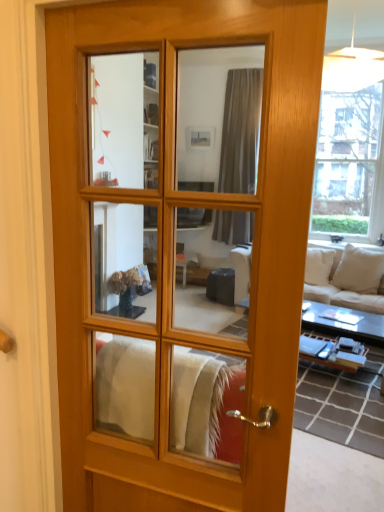
The image size is (384, 512). In order to click on matte wood door at center in this screenshot , I will do `click(173, 248)`.

What do you see at coordinates (173, 248) in the screenshot? The image size is (384, 512). I see `matte wood door at center` at bounding box center [173, 248].

You are a GUI agent. You are given a task and a screenshot of the screen. Output one action in this format:
    pyautogui.click(x=<x>, y=<y>)
    Task: Click on the white fabric couch at right
    This screenshot has height=512, width=384.
    Given the screenshot: What is the action you would take?
    click(346, 277)

This screenshot has width=384, height=512. What do you see at coordinates (346, 277) in the screenshot?
I see `white fabric couch at right` at bounding box center [346, 277].

Find the location of a particular element. matte wood door at center is located at coordinates (173, 248).

Between white fabric couch at right and matte wood door at center, which one appears on the left side from the viewer's perspective?

Positioned to the left is matte wood door at center.

Which object is more forward, white fabric couch at right or matte wood door at center?

matte wood door at center is in front.

Is point (309, 272) closer or farther from the camera than point (208, 205)?

Clearly, point (309, 272) is more distant from the camera than point (208, 205).

From the image's perspective, is white fabric couch at right on matte wood door at center?

No, from the image's perspective, white fabric couch at right is not above matte wood door at center.

From a real-world perspective, is white fabric couch at right below matte wood door at center?

Yes, from a real-world perspective, white fabric couch at right is below matte wood door at center.

Between white fabric couch at right and matte wood door at center, which one has smaller width?

matte wood door at center is thinner.

Is white fabric couch at right taller than matte wood door at center?

No, white fabric couch at right is not taller than matte wood door at center.

Is white fabric couch at right smaller than matte wood door at center?

No.

Is white fabric couch at right surrounding matte wood door at center?

No, white fabric couch at right does not contain matte wood door at center.

Is white fabric couch at right far from matte wood door at center?

Indeed, white fabric couch at right is not near matte wood door at center.

Is white fabric couch at right positioned with its back to matte wood door at center?

No, matte wood door at center is not at the back of white fabric couch at right.

Can you tell me how much white fabric couch at right and matte wood door at center differ in facing direction?

The angular difference between white fabric couch at right and matte wood door at center is 167 degrees.

The height and width of the screenshot is (512, 384). I want to click on studio couch located underneath the matte wood door at center (from a real-world perspective), so click(x=346, y=277).

Does matte wood door at center appear on the left side of white fabric couch at right?

Indeed, matte wood door at center is positioned on the left side of white fabric couch at right.

Is matte wood door at center further to the viewer compared to white fabric couch at right?

No, it is in front of white fabric couch at right.

Which point is more distant from viewer, (100, 499) or (335, 266)?

The point (335, 266) is farther from the camera.

From the image's perspective, which one is positioned higher, matte wood door at center or white fabric couch at right?

From the image's view, matte wood door at center is above.

From a real-world perspective, does matte wood door at center sit lower than white fabric couch at right?

No, from a real-world perspective, matte wood door at center is not below white fabric couch at right.

Is matte wood door at center wider or thinner than white fabric couch at right?

Considering their sizes, matte wood door at center looks slimmer than white fabric couch at right.

In the scene shown: Who is taller, matte wood door at center or white fabric couch at right?

matte wood door at center is taller.

Is matte wood door at center bigger than white fabric couch at right?

Actually, matte wood door at center might be smaller than white fabric couch at right.

Is matte wood door at center completely or partially outside of white fabric couch at right?

Yes.

Are matte wood door at center and white fabric couch at right beside each other?

No, matte wood door at center is not in contact with white fabric couch at right.

Is matte wood door at center oriented towards white fabric couch at right?

Yes, matte wood door at center is aimed at white fabric couch at right.

How many degrees apart are the facing directions of matte wood door at center and white fabric couch at right?

The angle between the facing direction of matte wood door at center and the facing direction of white fabric couch at right is 167 degrees.

Measure the distance from matte wood door at center to white fabric couch at right.

matte wood door at center and white fabric couch at right are 9.84 feet apart from each other.

The width and height of the screenshot is (384, 512). In order to click on studio couch on the right of the matte wood door at center in this screenshot , I will do `click(346, 277)`.

Locate an element on the screen. The height and width of the screenshot is (512, 384). door that appears above the white fabric couch at right (from a real-world perspective) is located at coordinates (173, 248).

You are a GUI agent. You are given a task and a screenshot of the screen. Output one action in this format:
    pyautogui.click(x=<x>, y=<y>)
    Task: Click on the door that appears in front of the white fabric couch at right
    Image resolution: width=384 pixels, height=512 pixels.
    Given the screenshot: What is the action you would take?
    pyautogui.click(x=173, y=248)